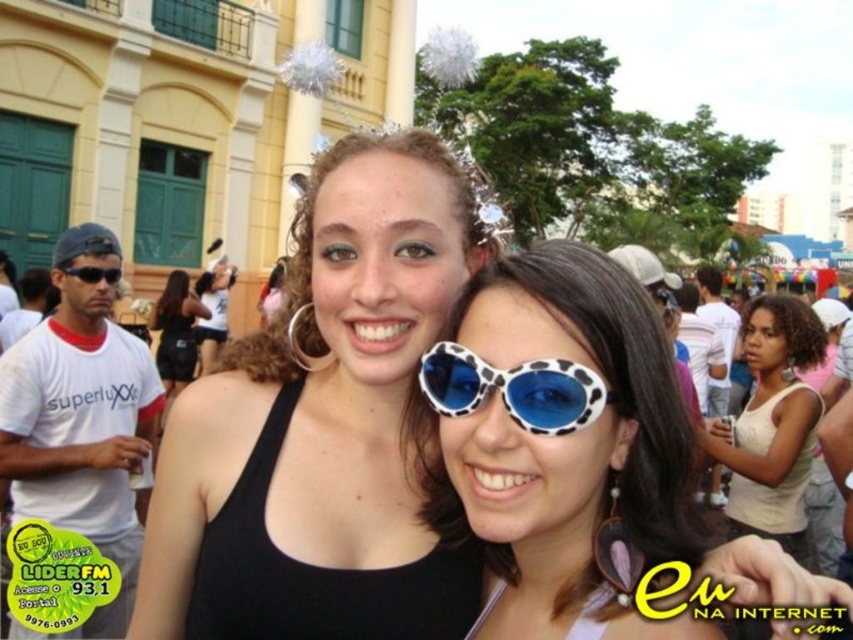
Between blue leopard print sunglasses at center and matte black sunglasses at center, which one has less height?

matte black sunglasses at center

Is point (488, 387) positioned after point (115, 282)?

No, (488, 387) is closer to viewer.

Identify the location of blue leopard print sunglasses at center. (514, 388).

Is point (234, 522) positioned behind point (96, 275)?

No.

Is black matte tank top at center to the right of matte black sunglasses at center from the viewer's perspective?

Correct, you'll find black matte tank top at center to the right of matte black sunglasses at center.

Where is `black matte tank top at center`? This screenshot has height=640, width=853. black matte tank top at center is located at coordinates (322, 426).

In the scene shown: Is white matte tank top at center to the right of matte black sunglasses at center from the viewer's perspective?

Indeed, white matte tank top at center is positioned on the right side of matte black sunglasses at center.

Does white matte tank top at center have a greater width compared to matte black sunglasses at center?

Indeed, white matte tank top at center has a greater width compared to matte black sunglasses at center.

Image resolution: width=853 pixels, height=640 pixels. I want to click on white matte tank top at center, so click(x=772, y=426).